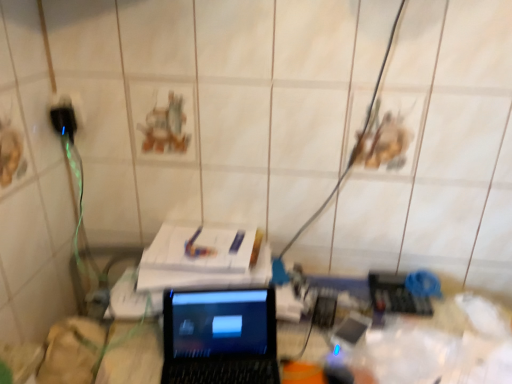
Question: Is point (269, 382) closer or farther from the camera than point (60, 107)?

Choices:
 (A) closer
 (B) farther

Answer: (A)

Question: Is black glossy laptop at center in front of or behind black plastic plug at left in the image?

Choices:
 (A) front
 (B) behind

Answer: (A)

Question: From a real-world perspective, relative to black plastic plug at left, is black glossy laptop at center vertically above or below?

Choices:
 (A) above
 (B) below

Answer: (B)

Question: Considering the positions of black plastic plug at left and black glossy laptop at center in the image, is black plastic plug at left wider or thinner than black glossy laptop at center?

Choices:
 (A) wide
 (B) thin

Answer: (B)

Question: From the image's perspective, is black plastic plug at left positioned above or below black glossy laptop at center?

Choices:
 (A) above
 (B) below

Answer: (A)

Question: Is black plastic plug at left bigger or smaller than black glossy laptop at center?

Choices:
 (A) big
 (B) small

Answer: (B)

Question: From a real-world perspective, relative to black glossy laptop at center, is black plastic plug at left vertically above or below?

Choices:
 (A) above
 (B) below

Answer: (A)